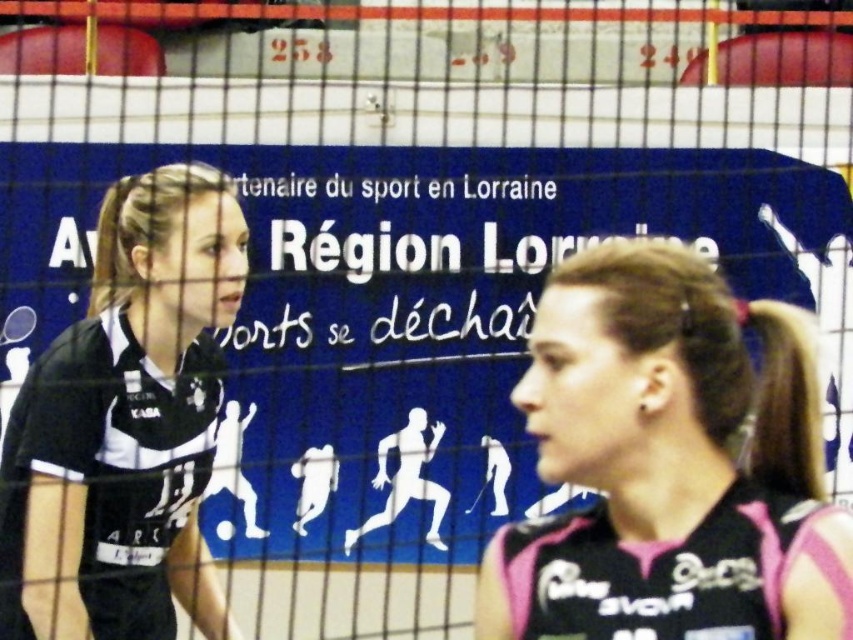
You are a volleyball coach observing the players. Which player is closer to the net, the pink jersey at right or the black jersey at left?

The pink jersey at right is closer to the net because it is in front of the black jersey at left.

Which player is positioned to the right of the other? The one wearing the pink jersey at right or the one in the black jersey at left?

The pink jersey at right is positioned to the right of the black jersey at left.